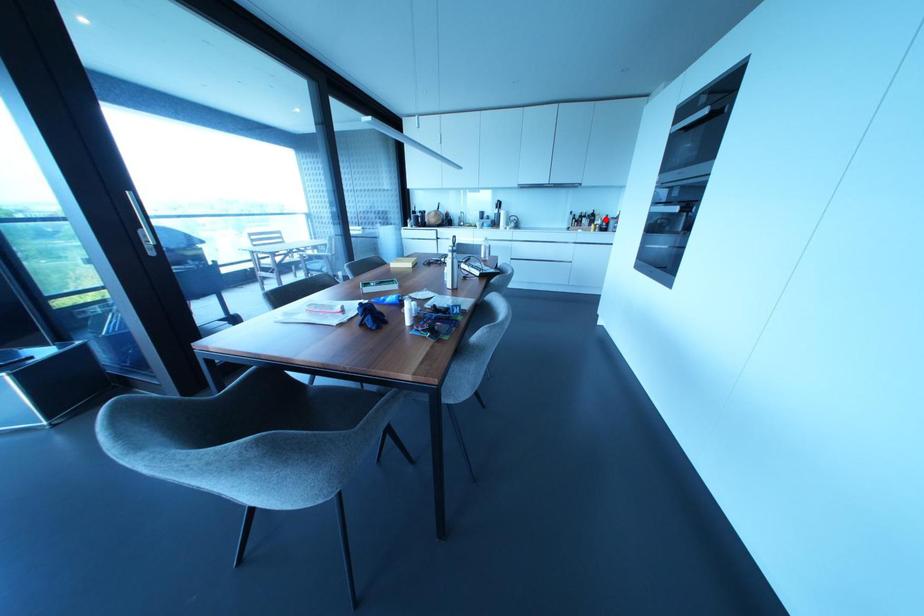
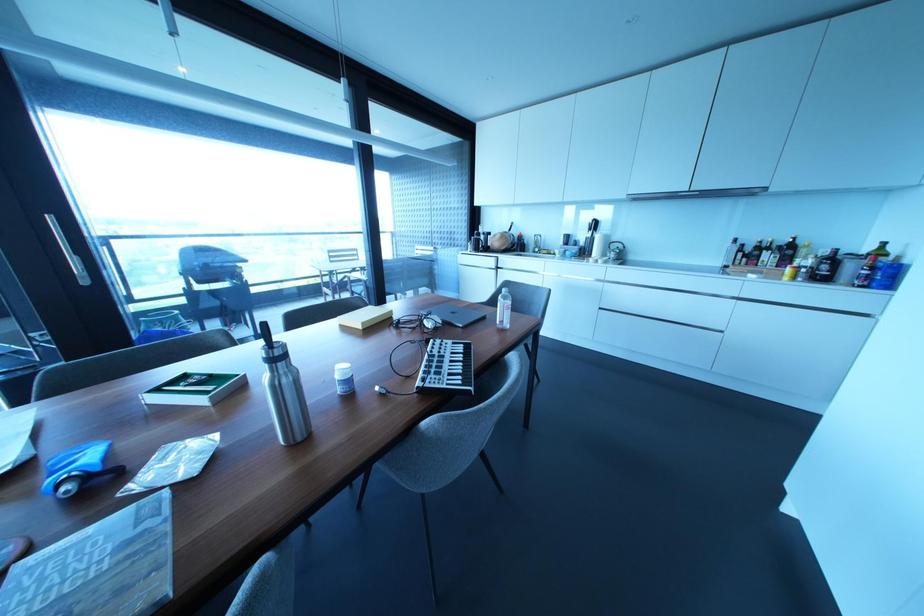
The point at the highlighted location is marked in the first image. Where is the corresponding point in the second image?

(833, 257)